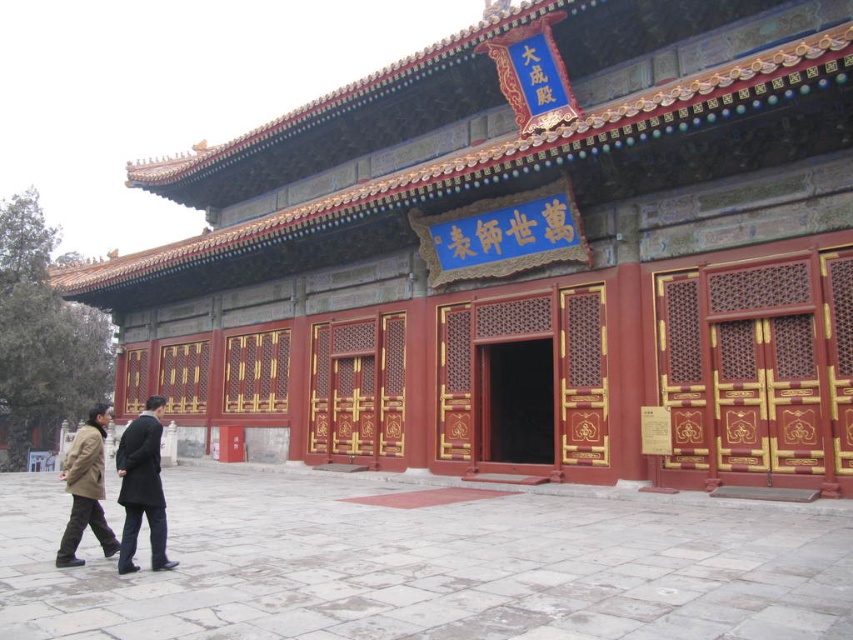
Who is positioned more to the right, dark gray wool coat at lower left or brown leather jacket at lower left?

Positioned to the right is dark gray wool coat at lower left.

Does point (144, 451) come behind point (93, 440)?

No, it is not.

Find the location of a particular element. The width and height of the screenshot is (853, 640). dark gray wool coat at lower left is located at coordinates (142, 486).

Which is in front, point (322, 179) or point (158, 436)?

Point (158, 436) is more forward.

Based on the photo, is matte red wood palace at center closer to the viewer compared to dark gray wool coat at lower left?

That is False.

Describe the element at coordinates (526, 256) in the screenshot. I see `matte red wood palace at center` at that location.

The width and height of the screenshot is (853, 640). Identify the location of matte red wood palace at center. (526, 256).

Is point (126, 173) in front of point (97, 464)?

No, it is not.

Between point (648, 467) and point (80, 528), which one is positioned behind?

The point (648, 467) is more distant.

Find the location of a particular element. matte red wood palace at center is located at coordinates (526, 256).